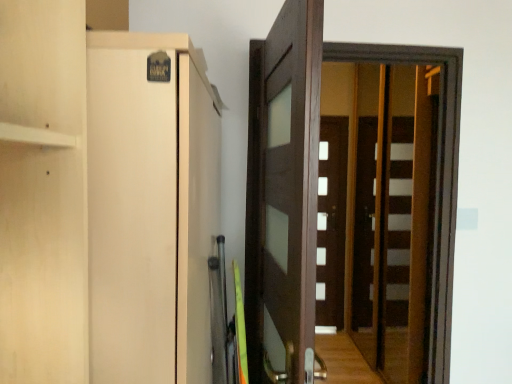
Question: Are brown wooden screen door at center and white matte door at center, the second door from the left, located far from each other?

Choices:
 (A) yes
 (B) no

Answer: (A)

Question: Can you confirm if brown wooden screen door at center is taller than white matte door at center, which appears as the 1th door when viewed from the right?

Choices:
 (A) yes
 (B) no

Answer: (B)

Question: Is brown wooden screen door at center aimed at white matte door at center, the second door from the left?

Choices:
 (A) no
 (B) yes

Answer: (A)

Question: Considering the relative positions of brown wooden screen door at center and white matte door at center, the second door from the left, in the image provided, is brown wooden screen door at center behind white matte door at center, the second door from the left,?

Choices:
 (A) no
 (B) yes

Answer: (A)

Question: Is brown wooden screen door at center outside of white matte door at center, the second door from the left?

Choices:
 (A) yes
 (B) no

Answer: (A)

Question: Considering the positions of dark wood door at center, acting as the second door starting from the back, and brown wooden screen door at center in the image, is dark wood door at center, acting as the second door starting from the back, taller or shorter than brown wooden screen door at center?

Choices:
 (A) short
 (B) tall

Answer: (A)

Question: Based on their sizes in the image, would you say dark wood door at center, acting as the second door starting from the back, is bigger or smaller than brown wooden screen door at center?

Choices:
 (A) small
 (B) big

Answer: (B)

Question: Considering their positions, is dark wood door at center, arranged as the 1th door when viewed from the left, located in front of or behind brown wooden screen door at center?

Choices:
 (A) behind
 (B) front

Answer: (B)

Question: Is dark wood door at center, acting as the second door starting from the back, inside or outside of brown wooden screen door at center?

Choices:
 (A) outside
 (B) inside

Answer: (A)

Question: Would you say brown wooden screen door at center is inside or outside white matte door at center, which appears as the 1th door when viewed from the right?

Choices:
 (A) outside
 (B) inside

Answer: (A)

Question: Is point (446, 155) positioned closer to the camera than point (320, 251)?

Choices:
 (A) farther
 (B) closer

Answer: (B)

Question: From the image's perspective, is brown wooden screen door at center above or below white matte door at center, positioned as the second door in front-to-back order?

Choices:
 (A) below
 (B) above

Answer: (B)

Question: Considering their positions, is brown wooden screen door at center located in front of or behind white matte door at center, the second door from the left?

Choices:
 (A) behind
 (B) front

Answer: (B)

Question: In the image, is white matte door at center, positioned as the second door in front-to-back order, on the left side or the right side of brown wooden screen door at center?

Choices:
 (A) left
 (B) right

Answer: (B)

Question: From a real-world perspective, is white matte door at center, which appears as the 1th door when viewed from the right, above or below brown wooden screen door at center?

Choices:
 (A) above
 (B) below

Answer: (B)